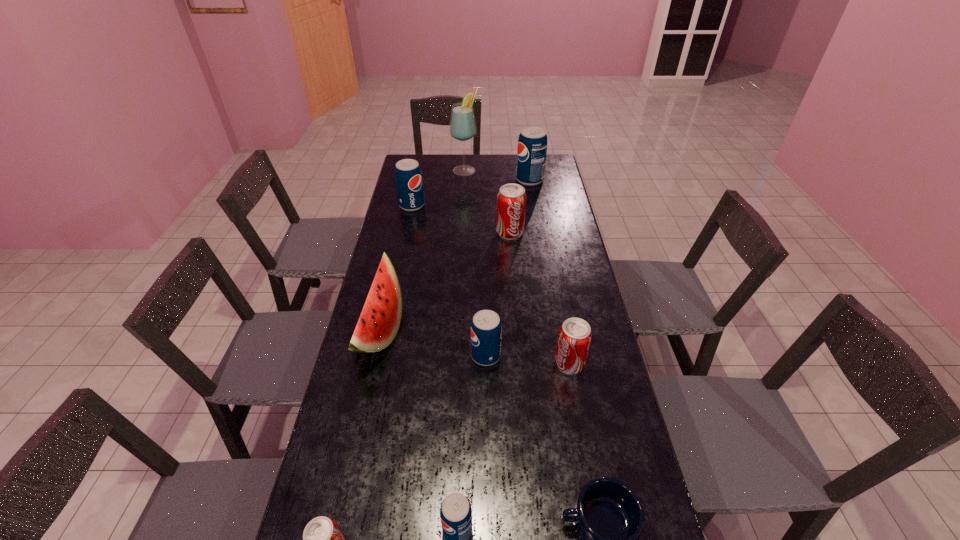
Locate an element on the screen. the second smallest red soda can is located at coordinates (574, 338).

Image resolution: width=960 pixels, height=540 pixels. In order to click on vacant space located 0.100m on the right of the alcohol in this screenshot , I will do `click(499, 170)`.

Find the location of a particular element. The width and height of the screenshot is (960, 540). blank area located on the back of the farthest blue pop is located at coordinates (526, 158).

Locate an element on the screen. The image size is (960, 540). vacant space located 0.120m on the front of the sixth nearest pop is located at coordinates (407, 230).

Locate an element on the screen. This screenshot has height=540, width=960. free point located on the left of the seventh nearest object is located at coordinates (396, 233).

Where is `vacant space located on the outer rind of the watermelon`? This screenshot has width=960, height=540. vacant space located on the outer rind of the watermelon is located at coordinates (485, 332).

What are the coordinates of `vacant region located 0.400m on the back of the third farthest blue pop` in the screenshot? It's located at (485, 259).

This screenshot has width=960, height=540. I want to click on vacant area situated on the right of the second farthest red soda can, so click(609, 364).

Identify the location of alcohol located in the far edge section of the desktop. Image resolution: width=960 pixels, height=540 pixels. (462, 127).

The image size is (960, 540). Identify the location of pop situated at the far edge. (532, 144).